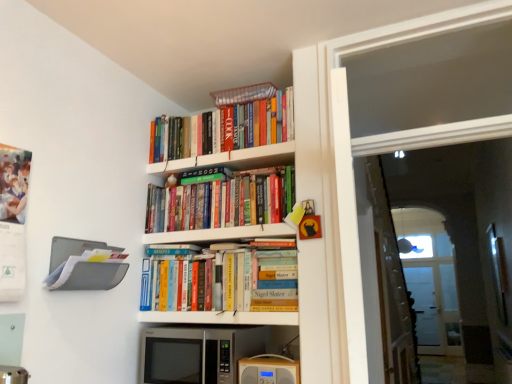
Question: Looking at the image, does hardcover books at upper center, the 1th book when ordered from top to bottom, seem bigger or smaller compared to transparent plastic screen door at right?

Choices:
 (A) small
 (B) big

Answer: (A)

Question: Is hardcover books at upper center, placed as the third book when sorted from bottom to top, taller or shorter than transparent plastic screen door at right?

Choices:
 (A) short
 (B) tall

Answer: (A)

Question: Estimate the real-world distances between objects in this image. Which object is closer to the white glossy bookshelf at upper center, which is the 2th shelf in top-to-bottom order?

Choices:
 (A) hardcover books at center, positioned as the 1th shelf in bottom-to-top order
 (B) hardcover books at upper center, placed as the third book when sorted from bottom to top
 (C) hardcover books at upper center, which ranks as the first shelf in top-to-bottom order
 (D) hardcover books at center, which ranks as the first book in bottom-to-top order
 (E) wooden radio at lower center

Answer: (D)

Question: Which object is the farthest from the transparent glass door at upper right?

Choices:
 (A) wooden radio at lower center
 (B) silver metallic microwave at lower center
 (C) hardcover books at center, the third book from the top
 (D) hardcover books at upper center, which ranks as the first shelf in top-to-bottom order
 (E) gray plastic file organizer at left, the 2th shelf ordered from the bottom

Answer: (E)